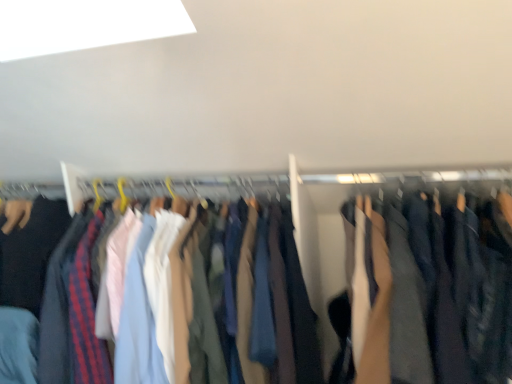
Question: Relative to dark blue cotton pants at center, is dark gray fabric pants at right in front or behind?

Choices:
 (A) front
 (B) behind

Answer: (A)

Question: Considering the positions of dark gray fabric pants at right and dark blue cotton pants at center in the image, is dark gray fabric pants at right bigger or smaller than dark blue cotton pants at center?

Choices:
 (A) small
 (B) big

Answer: (A)

Question: From the image's perspective, is dark gray fabric pants at right located above or below dark blue cotton pants at center?

Choices:
 (A) below
 (B) above

Answer: (B)

Question: Considering the positions of dark blue cotton pants at center and dark gray fabric pants at right in the image, is dark blue cotton pants at center bigger or smaller than dark gray fabric pants at right?

Choices:
 (A) small
 (B) big

Answer: (B)

Question: Considering the positions of dark blue cotton pants at center and dark gray fabric pants at right in the image, is dark blue cotton pants at center taller or shorter than dark gray fabric pants at right?

Choices:
 (A) short
 (B) tall

Answer: (B)

Question: From the image's perspective, is dark blue cotton pants at center located above or below dark gray fabric pants at right?

Choices:
 (A) below
 (B) above

Answer: (A)

Question: Do you think dark blue cotton pants at center is within dark gray fabric pants at right, or outside of it?

Choices:
 (A) inside
 (B) outside

Answer: (B)